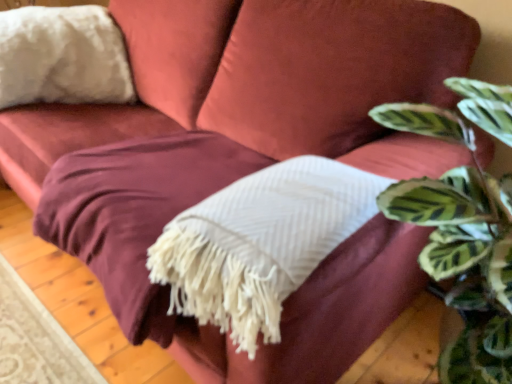
Question: From the image's perspective, is green striped leaf at upper right under white fluffy pillow at upper left?

Choices:
 (A) yes
 (B) no

Answer: (A)

Question: Is white fluffy pillow at upper left a part of green striped leaf at upper right?

Choices:
 (A) yes
 (B) no

Answer: (B)

Question: From the image's perspective, would you say green striped leaf at upper right is positioned over white fluffy pillow at upper left?

Choices:
 (A) no
 (B) yes

Answer: (A)

Question: Would you say green striped leaf at upper right is outside white fluffy pillow at upper left?

Choices:
 (A) no
 (B) yes

Answer: (B)

Question: Considering the relative positions of green striped leaf at upper right and white fluffy pillow at upper left in the image provided, is green striped leaf at upper right to the left of white fluffy pillow at upper left from the viewer's perspective?

Choices:
 (A) yes
 (B) no

Answer: (B)

Question: Is green striped leaf at upper right to the left or to the right of white fluffy pillow at upper left in the image?

Choices:
 (A) right
 (B) left

Answer: (A)

Question: From the image's perspective, is green striped leaf at upper right positioned above or below white fluffy pillow at upper left?

Choices:
 (A) below
 (B) above

Answer: (A)

Question: Does point (472, 188) appear closer or farther from the camera than point (13, 94)?

Choices:
 (A) farther
 (B) closer

Answer: (B)

Question: Is green striped leaf at upper right spatially inside white fluffy pillow at upper left, or outside of it?

Choices:
 (A) outside
 (B) inside

Answer: (A)

Question: Looking at the image, does white fluffy pillow at upper left seem bigger or smaller compared to green striped leaf at upper right?

Choices:
 (A) small
 (B) big

Answer: (A)

Question: Considering their positions, is white fluffy pillow at upper left located in front of or behind green striped leaf at upper right?

Choices:
 (A) behind
 (B) front

Answer: (A)

Question: Is white fluffy pillow at upper left to the left or to the right of green striped leaf at upper right in the image?

Choices:
 (A) left
 (B) right

Answer: (A)

Question: From a real-world perspective, is white fluffy pillow at upper left physically located above or below green striped leaf at upper right?

Choices:
 (A) above
 (B) below

Answer: (A)

Question: In the image, is green striped leaf at upper right on the left side or the right side of white textured blanket at center?

Choices:
 (A) right
 (B) left

Answer: (A)

Question: Is green striped leaf at upper right in front of or behind white textured blanket at center in the image?

Choices:
 (A) front
 (B) behind

Answer: (A)